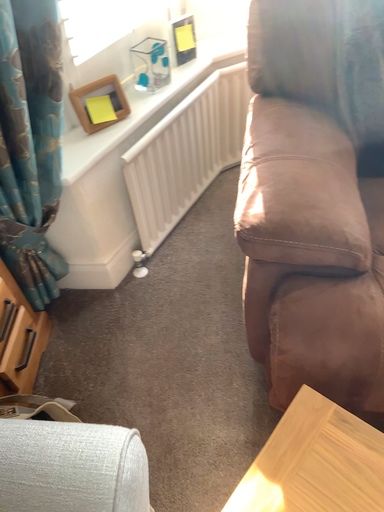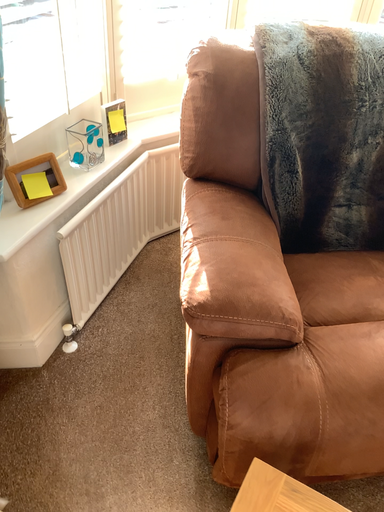
Question: Which way did the camera rotate in the video?

Choices:
 (A) rotated downward
 (B) rotated upward

Answer: (B)